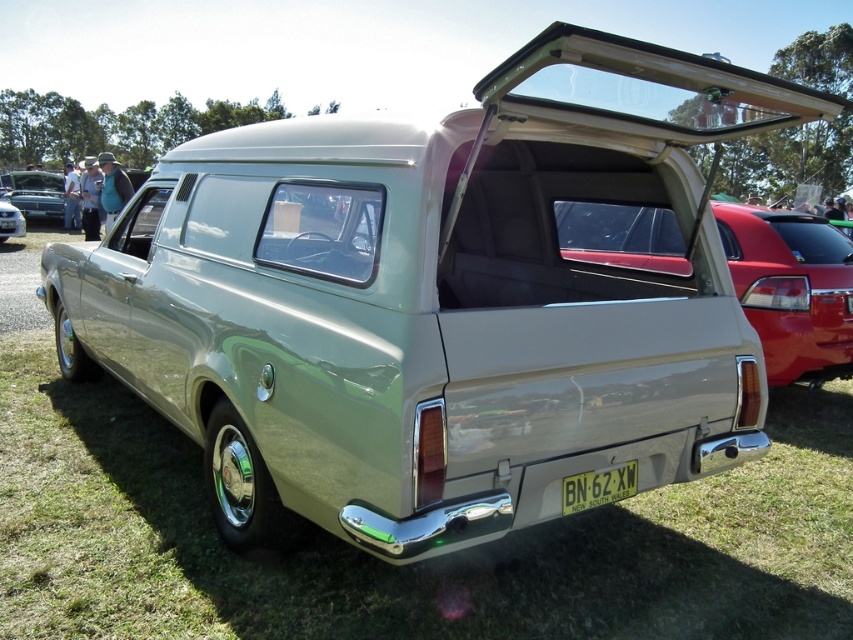
Question: Is satin silver panel at center below shiny black car at left?

Choices:
 (A) yes
 (B) no

Answer: (A)

Question: Is the position of satin silver panel at center less distant than that of satin silver panel van at center?

Choices:
 (A) yes
 (B) no

Answer: (A)

Question: Among these objects, which one is farthest from the camera?

Choices:
 (A) green glossy car at center
 (B) satin silver panel van at center
 (C) satin silver panel at center

Answer: (B)

Question: From the image, what is the correct spatial relationship of satin silver panel at center in relation to shiny black car at left?

Choices:
 (A) left
 (B) right

Answer: (B)

Question: Among these points, which one is nearest to the camera?

Choices:
 (A) (177, 433)
 (B) (590, 472)
 (C) (44, 198)
 (D) (590, 234)

Answer: (B)

Question: Which point is farther to the camera?

Choices:
 (A) shiny black car at left
 (B) white plastic license plate at center

Answer: (A)